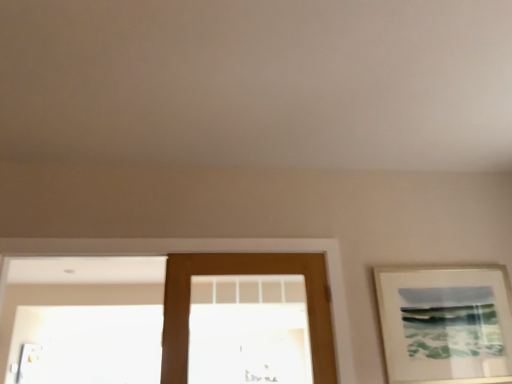
Question: Is point (102, 251) positioned closer to the camera than point (505, 278)?

Choices:
 (A) closer
 (B) farther

Answer: (A)

Question: Is brown wooden door at center inside or outside of matte white picture frame at right?

Choices:
 (A) outside
 (B) inside

Answer: (A)

Question: Which object is positioned farthest from the brown wooden door at center?

Choices:
 (A) brown wooden door at center
 (B) matte white picture frame at right

Answer: (B)

Question: Which is nearer to the brown wooden door at center?

Choices:
 (A) brown wooden door at center
 (B) matte white picture frame at right

Answer: (A)